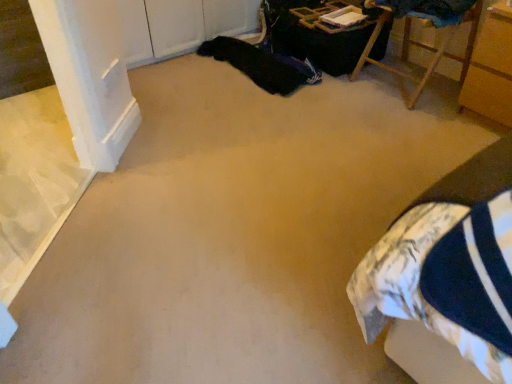
I want to click on vacant area situated to the left side of wooden cabinet at right, the 1th furniture in the right-to-left sequence, so click(436, 124).